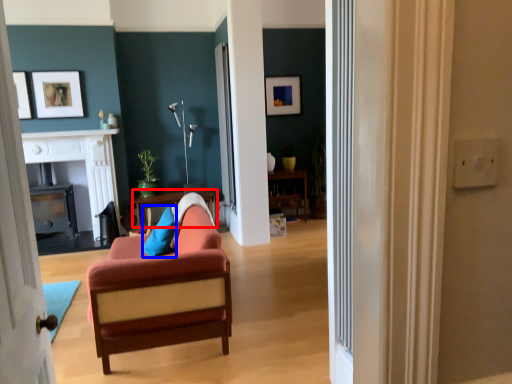
Question: Which object is further to the camera taking this photo, table (highlighted by a red box) or pillow (highlighted by a blue box)?

Choices:
 (A) table
 (B) pillow

Answer: (A)